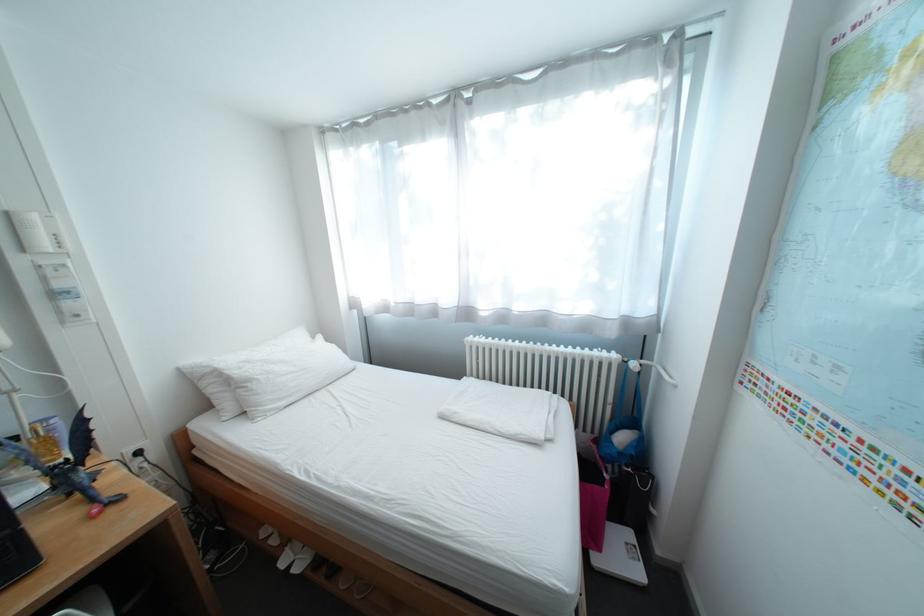
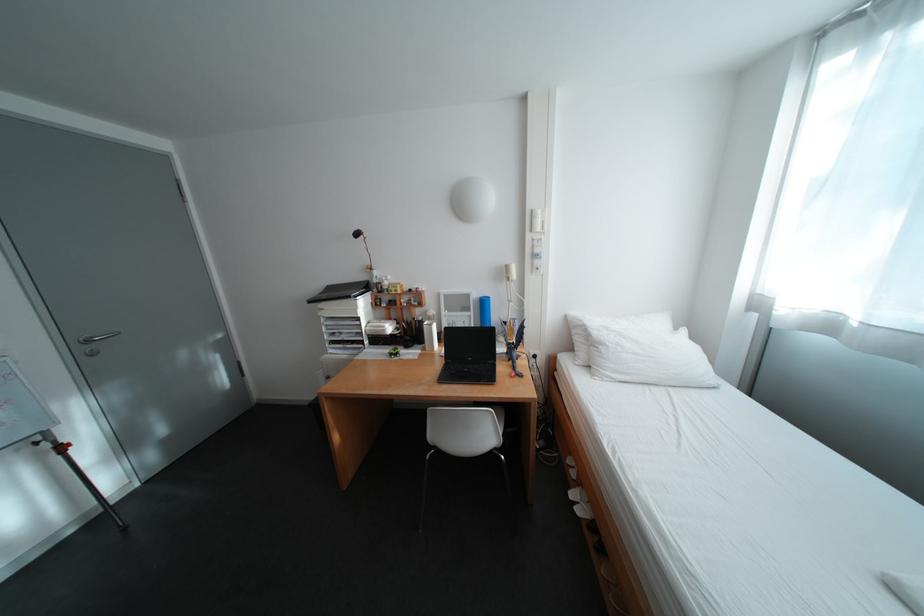
Locate, in the second image, the point that corresponds to (x=263, y=383) in the first image.

(614, 346)